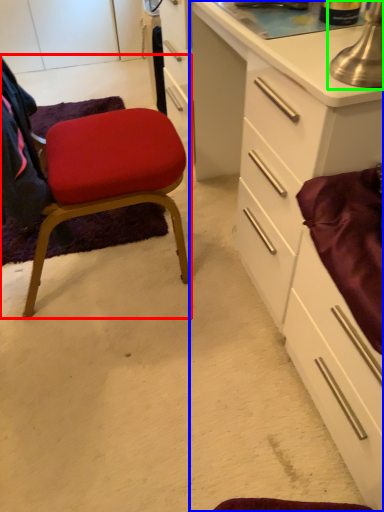
Question: Which object is positioned closest to chair (highlighted by a red box)? Select from cabinetry (highlighted by a blue box) and table lamp (highlighted by a green box).

Choices:
 (A) cabinetry
 (B) table lamp

Answer: (A)